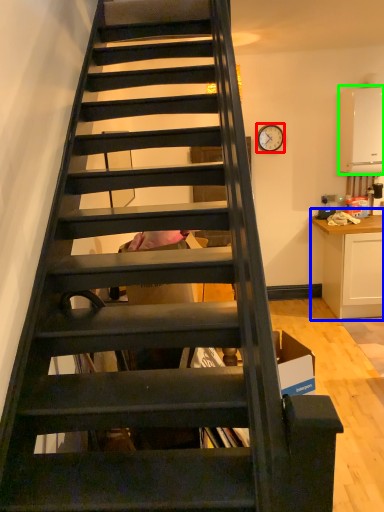
Question: Estimate the real-world distances between objects in this image. Which object is farther from clock (highlighted by a red box), cabinetry (highlighted by a blue box) or appliance (highlighted by a green box)?

Choices:
 (A) cabinetry
 (B) appliance

Answer: (A)